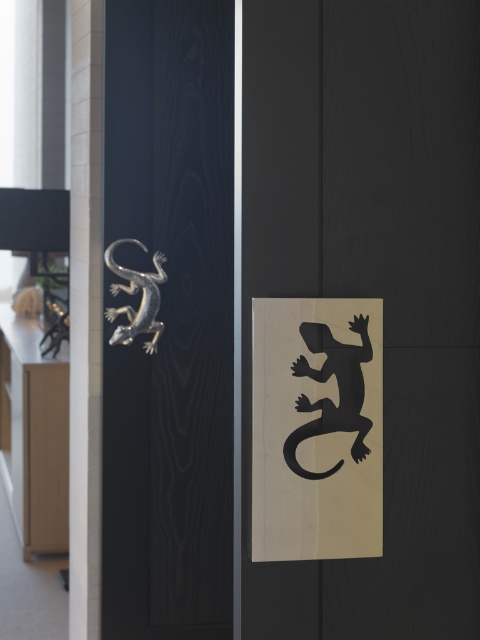
Does metallic lizard at center have a lesser height compared to black matte lizard at center?

Incorrect, metallic lizard at center's height does not fall short of black matte lizard at center's.

Does point (122, 531) lie in front of point (356, 378)?

No, (122, 531) is behind (356, 378).

Is point (191, 500) more distant than point (339, 388)?

Yes, point (191, 500) is farther from viewer.

Image resolution: width=480 pixels, height=640 pixels. In order to click on metallic lizard at center in this screenshot , I will do `click(169, 321)`.

Does metallic lizard at center lie behind black paper lizard at center?

Result: Yes, it is behind black paper lizard at center.

Between point (112, 209) and point (260, 454), which one is positioned behind?

The point (112, 209) is more distant.

This screenshot has height=640, width=480. I want to click on metallic lizard at center, so click(169, 321).

Between black paper lizard at center and polished silver lizard at upper left, which one is positioned higher?

polished silver lizard at upper left is above.

Is point (360, 531) behind point (143, 282)?

No, it is in front of (143, 282).

Find the location of `black paper lizard at center`. black paper lizard at center is located at coordinates (316, 428).